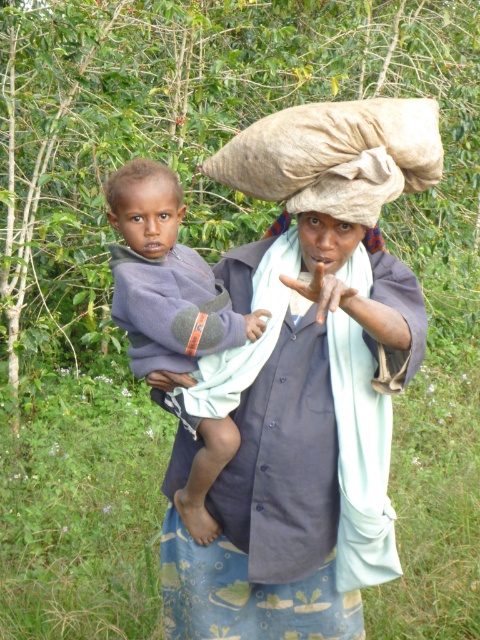
You are a tailor observing the woman and the child in the image. You need to determine which fabric item at the center has a greater width between the blue fabric at center and the dark gray fleece at center. Which one is wider?

The blue fabric at center is wider than the dark gray fleece at center according to the description provided.

From the picture: You are a fashion designer observing the rural scene. You notice the blue fabric at center and the dark brown skin at center. Which object is wider?

The blue fabric at center is wider than the dark brown skin at center.